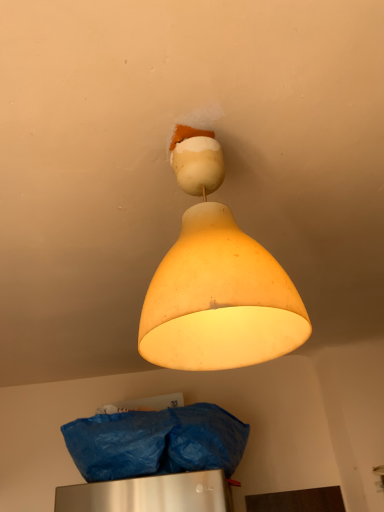
Question: From a real-world perspective, is blue plastic bag at lower center over matte yellow lampshade at upper center?

Choices:
 (A) yes
 (B) no

Answer: (B)

Question: Does blue plastic bag at lower center lie behind matte yellow lampshade at upper center?

Choices:
 (A) yes
 (B) no

Answer: (A)

Question: Is blue plastic bag at lower center to the left of matte yellow lampshade at upper center from the viewer's perspective?

Choices:
 (A) no
 (B) yes

Answer: (B)

Question: From the image's perspective, would you say blue plastic bag at lower center is positioned over matte yellow lampshade at upper center?

Choices:
 (A) yes
 (B) no

Answer: (B)

Question: Is blue plastic bag at lower center looking in the opposite direction of matte yellow lampshade at upper center?

Choices:
 (A) no
 (B) yes

Answer: (A)

Question: From the image's perspective, is blue plastic bag at lower center under matte yellow lampshade at upper center?

Choices:
 (A) yes
 (B) no

Answer: (A)

Question: Is matte yellow lampshade at upper center wider than blue plastic bag at lower center?

Choices:
 (A) yes
 (B) no

Answer: (B)

Question: Can you confirm if matte yellow lampshade at upper center is positioned to the right of blue plastic bag at lower center?

Choices:
 (A) yes
 (B) no

Answer: (A)

Question: From a real-world perspective, is matte yellow lampshade at upper center physically below blue plastic bag at lower center?

Choices:
 (A) no
 (B) yes

Answer: (A)

Question: From the image's perspective, is matte yellow lampshade at upper center below blue plastic bag at lower center?

Choices:
 (A) yes
 (B) no

Answer: (B)

Question: Considering the relative sizes of matte yellow lampshade at upper center and blue plastic bag at lower center in the image provided, is matte yellow lampshade at upper center shorter than blue plastic bag at lower center?

Choices:
 (A) yes
 (B) no

Answer: (B)

Question: Are matte yellow lampshade at upper center and blue plastic bag at lower center far apart?

Choices:
 (A) no
 (B) yes

Answer: (A)

Question: Is point (178, 181) positioned closer to the camera than point (183, 458)?

Choices:
 (A) farther
 (B) closer

Answer: (B)